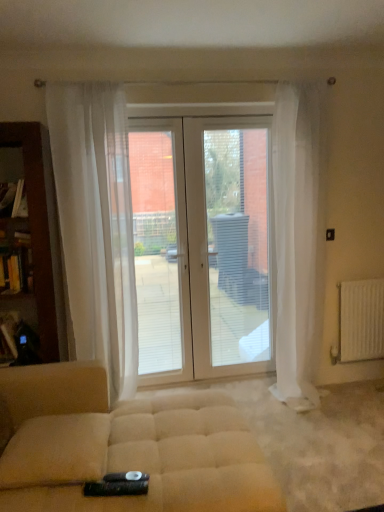
Identify the location of empty space that is ontop of white glossy door at center. This screenshot has height=512, width=384. (187, 119).